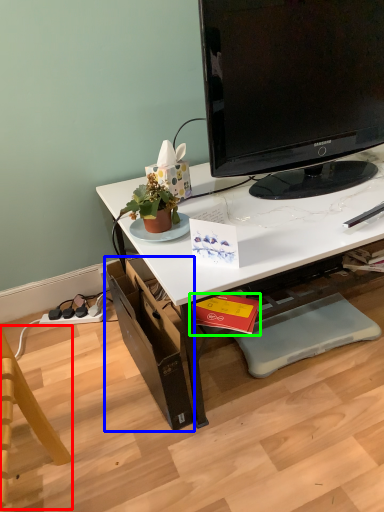
Question: Considering the real-world distances, which object is farthest from swivel chair (highlighted by a red box)? drawer (highlighted by a blue box) or book (highlighted by a green box)?

Choices:
 (A) drawer
 (B) book

Answer: (B)